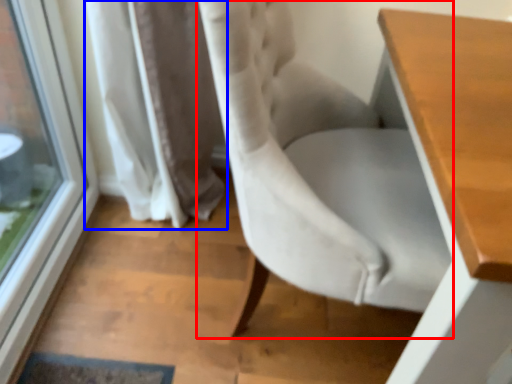
Question: Which object appears closest to the camera in this image, chair (highlighted by a red box) or curtain (highlighted by a blue box)?

Choices:
 (A) chair
 (B) curtain

Answer: (A)